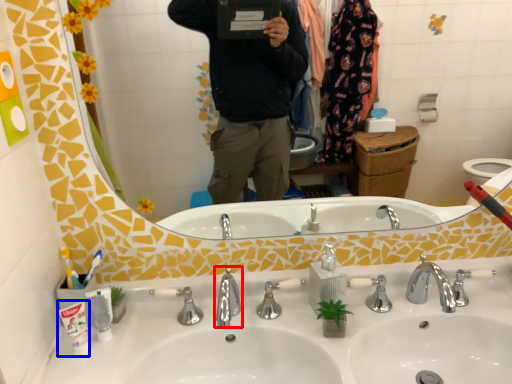
Question: Which of the following is the closest to the observer, tap (highlighted by a red box) or toothpaste (highlighted by a blue box)?

Choices:
 (A) tap
 (B) toothpaste

Answer: (A)